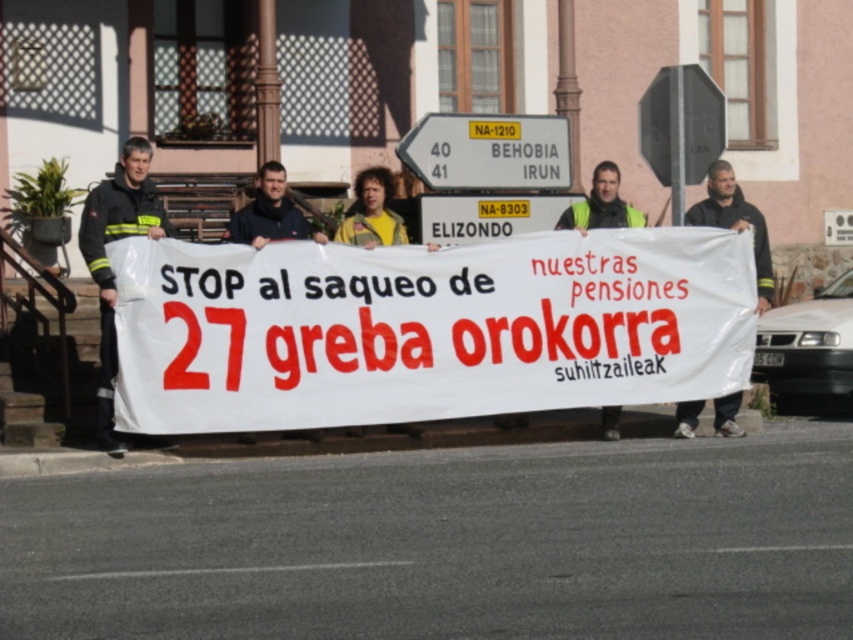
You are a photographer trying to capture a clear shot of both the dark blue sweater at center and the yellow fabric shirt at center. Based on their positions, which one should you focus on first to ensure both are in frame?

The dark blue sweater at center is to the left of the yellow fabric shirt at center, so focusing on the yellow fabric shirt at center first would allow you to adjust the frame to include both from left to right.

You are a photographer trying to capture the protest scene. You want to focus on the dark blue sweater at center. Where exactly should you point your camera to capture it?

You should point your camera to the coordinates point at (270, 212) to capture the dark blue sweater at center.